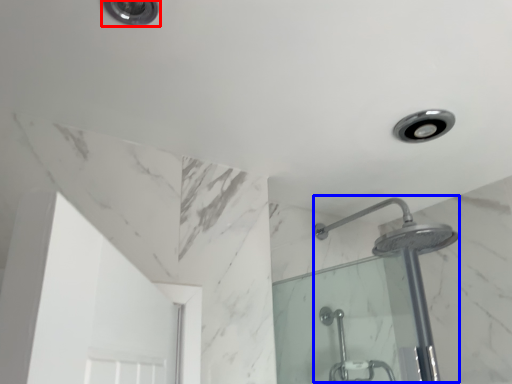
Question: Which of the following is the closest to the observer, light fixture (highlighted by a red box) or shower (highlighted by a blue box)?

Choices:
 (A) light fixture
 (B) shower

Answer: (A)